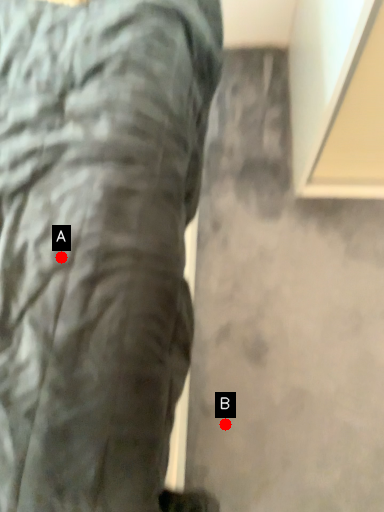
Question: Two points are circled on the image, labeled by A and B beside each circle. Which of the following is the farthest from the observer?

Choices:
 (A) A is further
 (B) B is further

Answer: (B)